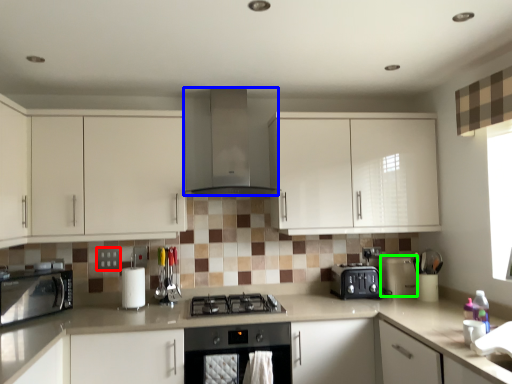
Question: Considering the real-world distances, which object is closest to square (highlighted by a red box)? home appliance (highlighted by a blue box) or appliance (highlighted by a green box).

Choices:
 (A) home appliance
 (B) appliance

Answer: (A)